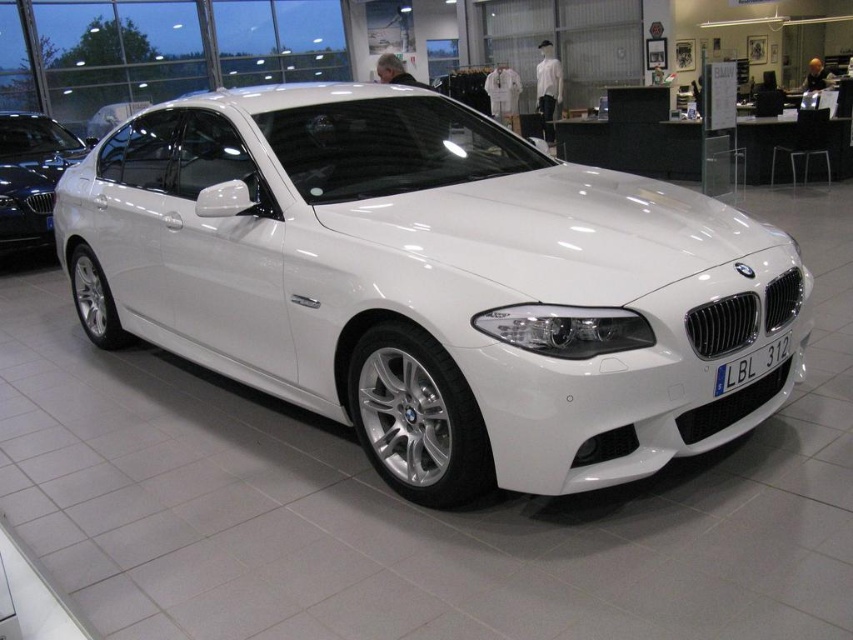
Question: Among these points, which one is nearest to the camera?

Choices:
 (A) (279, 193)
 (B) (21, 113)
 (C) (744, 356)

Answer: (C)

Question: Does white glossy car at center appear under white glossy sedan at center?

Choices:
 (A) yes
 (B) no

Answer: (A)

Question: Does white glossy car at center have a smaller size compared to white glossy sedan at center?

Choices:
 (A) yes
 (B) no

Answer: (B)

Question: Among these objects, which one is nearest to the camera?

Choices:
 (A) black plastic license plate at front
 (B) white glossy car at center

Answer: (B)

Question: Is white glossy car at center wider than black plastic license plate at front?

Choices:
 (A) yes
 (B) no

Answer: (A)

Question: Estimate the real-world distances between objects in this image. Which object is farther from the white glossy car at center?

Choices:
 (A) black plastic license plate at front
 (B) white glossy sedan at center

Answer: (B)